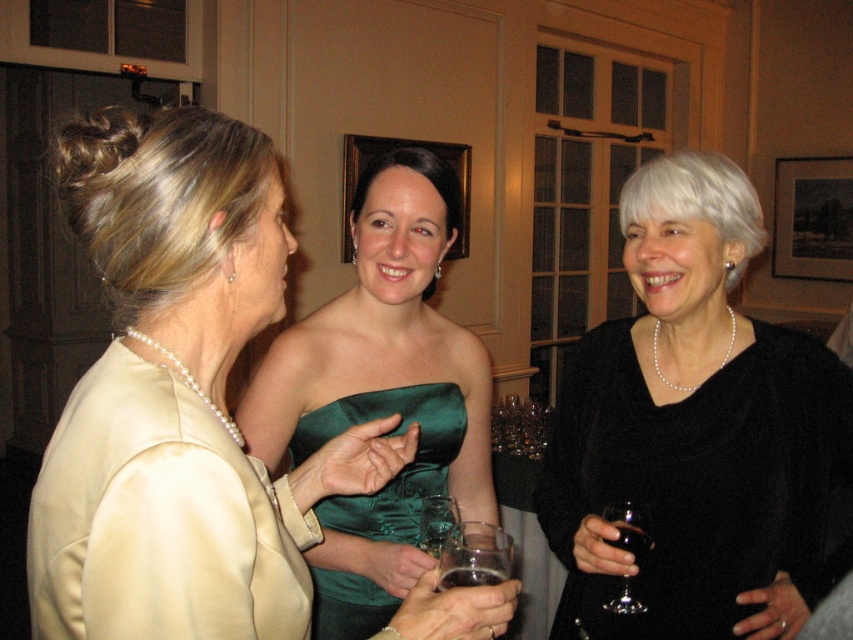
You are a bartender at the event and need to place a new drink between the transparent glass at center and the clear glass at center. The new drink requires 2 inches of space. Can you fit it there?

The transparent glass at center is 1.36 inches away from the clear glass at center, so there isn not enough space to fit a new drink requiring 2 inches of space between them.

You are a photographer at this event and need to capture a clear shot of the satin green dress at center without the translucent glass at lower right obstructing the view. Is this possible given their positions?

The satin green dress at center is positioned over the translucent glass at lower right, so the glass is below the dress. Since the glass is translucent, it may allow light through but could still create a blurry or reflective surface in the photo. However, adjusting the camera angle to avoid looking through the glass might help achieve a clear shot of the dress.

You are a photographer at this event and want to take a photo of the transparent glass at center. Where should you position your camera to capture it best?

The transparent glass at center is located at point [474,556] in 2D coordinates, so position the camera directly facing that coordinate for optimal capture.